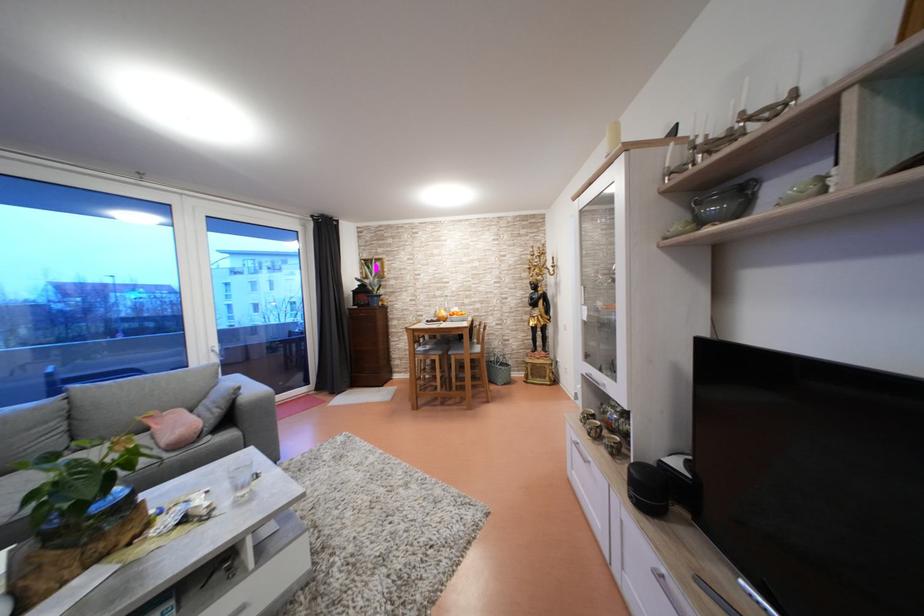
What do you see at coordinates (81, 475) in the screenshot? I see `the sofa sitting surface` at bounding box center [81, 475].